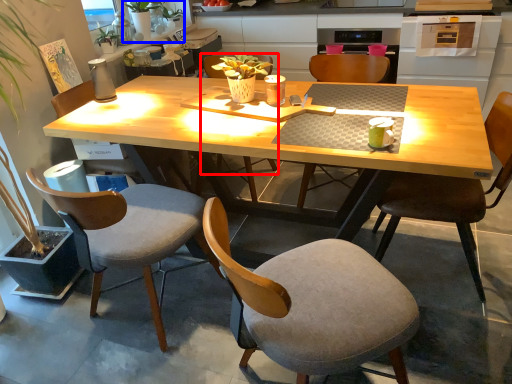
Question: Which of the following is the farthest to the observer, chair (highlighted by a red box) or houseplant (highlighted by a blue box)?

Choices:
 (A) chair
 (B) houseplant

Answer: (B)